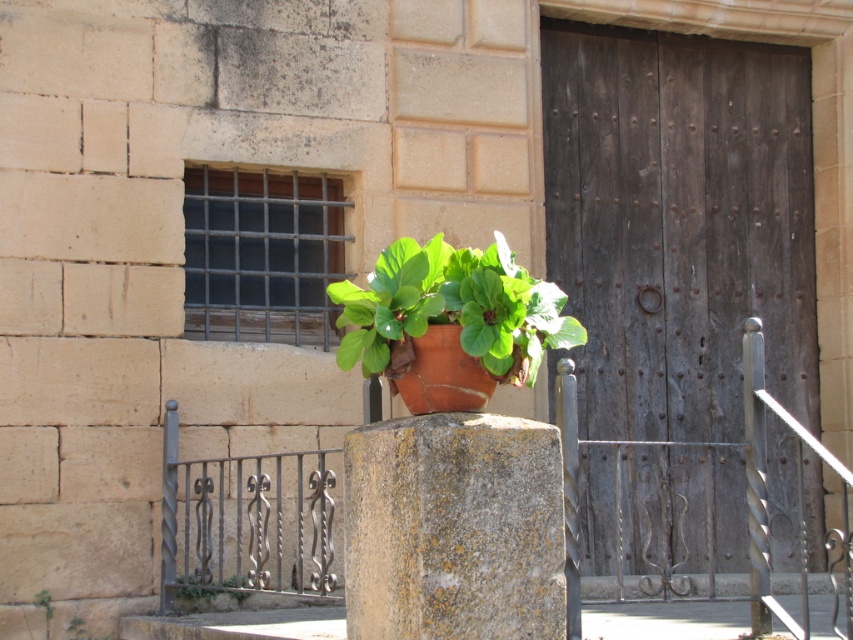
Question: Which point is farther to the camera?

Choices:
 (A) dark brown wooden door at center
 (B) terracotta pot at center

Answer: (A)

Question: Which point is farther to the camera?

Choices:
 (A) (219, 609)
 (B) (693, 244)
 (C) (526, 561)

Answer: (B)

Question: Can you confirm if dark brown wooden door at center is positioned above terracotta pot at center?

Choices:
 (A) yes
 (B) no

Answer: (A)

Question: Does terracotta pot at center appear over green leafy plant at lower center?

Choices:
 (A) no
 (B) yes

Answer: (B)

Question: Is terracotta pot at center further to camera compared to green leafy plant at lower center?

Choices:
 (A) no
 (B) yes

Answer: (A)

Question: Which point is farther to the camera?

Choices:
 (A) (809, 502)
 (B) (207, 596)

Answer: (A)